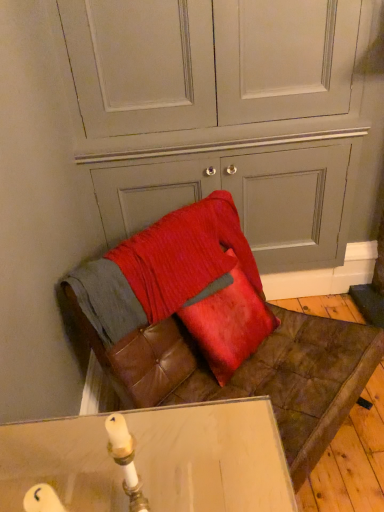
Where is `leather cushion at lower center`? This screenshot has height=512, width=384. leather cushion at lower center is located at coordinates (232, 116).

Is leather cushion at lower center facing towards satin red pillow at center?

Yes.

Considering the sizes of objects leather cushion at lower center and satin red pillow at center in the image provided, who is shorter, leather cushion at lower center or satin red pillow at center?

satin red pillow at center.

Considering the positions of objects leather cushion at lower center and satin red pillow at center in the image provided, who is more to the left, leather cushion at lower center or satin red pillow at center?

leather cushion at lower center is more to the left.

Is leather cushion at lower center positioned in front of satin red pillow at center?

No, the depth of leather cushion at lower center is greater than that of satin red pillow at center.

Which of these two, leather cushion at lower center or satin red pillow at center, stands shorter?

With less height is satin red pillow at center.

Who is smaller, leather cushion at lower center or satin red pillow at center?

Smaller between the two is satin red pillow at center.

Is leather cushion at lower center touching satin red pillow at center?

No, leather cushion at lower center is not in contact with satin red pillow at center.

From the image's perspective, which object appears higher, leather cushion at lower center or leather cushion at lower center?

From the image's view, leather cushion at lower center is above.

Locate an element on the screen. This screenshot has width=384, height=512. furniture below the leather cushion at lower center (from the image's perspective) is located at coordinates (249, 374).

Is leather cushion at lower center next to leather cushion at lower center and touching it?

No, leather cushion at lower center is not next to leather cushion at lower center.

Considering the sizes of objects leather cushion at lower center and leather cushion at lower center in the image provided, who is wider, leather cushion at lower center or leather cushion at lower center?

Wider between the two is leather cushion at lower center.

Is leather cushion at lower center inside satin red pillow at center?

No, leather cushion at lower center is located outside of satin red pillow at center.

Which of these two, satin red pillow at center or leather cushion at lower center, is bigger?

With larger size is leather cushion at lower center.

Looking at this image, is leather cushion at lower center smaller than leather cushion at lower center?

Yes.

Is leather cushion at lower center taller or shorter than leather cushion at lower center?

Clearly, leather cushion at lower center is shorter compared to leather cushion at lower center.

Is leather cushion at lower center surrounded by leather cushion at lower center?

No, leather cushion at lower center is not inside leather cushion at lower center.

What's the angular difference between leather cushion at lower center and leather cushion at lower center's facing directions?

They differ by 46 degrees in their facing directions.

Is satin red pillow at center aimed at leather cushion at lower center?

Yes, satin red pillow at center is turned towards leather cushion at lower center.

Is there a large distance between satin red pillow at center and leather cushion at lower center?

Actually, satin red pillow at center and leather cushion at lower center are a little close together.

Does satin red pillow at center contain leather cushion at lower center?

That's incorrect, leather cushion at lower center is not inside satin red pillow at center.

Visually, is satin red pillow at center positioned to the left or to the right of leather cushion at lower center?

From the image, it's evident that satin red pillow at center is to the left of leather cushion at lower center.

This screenshot has height=512, width=384. In order to click on throw pillow that is in front of the leather cushion at lower center in this screenshot , I will do `click(228, 321)`.

The width and height of the screenshot is (384, 512). I want to click on furniture below the satin red pillow at center (from a real-world perspective), so click(x=249, y=374).

Which object lies nearer to the anchor point leather cushion at lower center, satin red pillow at center or leather cushion at lower center?

Among the two, satin red pillow at center is located nearer to leather cushion at lower center.

Considering their positions, is leather cushion at lower center positioned closer to leather cushion at lower center than satin red pillow at center?

Among the two, satin red pillow at center is located nearer to leather cushion at lower center.

From the picture: Based on their spatial positions, is satin red pillow at center or leather cushion at lower center further from leather cushion at lower center?

Among the two, leather cushion at lower center is located further to leather cushion at lower center.

Based on their spatial positions, is leather cushion at lower center or satin red pillow at center further from leather cushion at lower center?

Based on the image, leather cushion at lower center appears to be further to leather cushion at lower center.

Considering their positions, is leather cushion at lower center positioned further to satin red pillow at center than leather cushion at lower center?

Based on the image, leather cushion at lower center appears to be further to satin red pillow at center.

When comparing their distances from satin red pillow at center, does leather cushion at lower center or leather cushion at lower center seem closer?

Based on the image, leather cushion at lower center appears to be nearer to satin red pillow at center.

Locate an element on the screen. throw pillow between leather cushion at lower center and leather cushion at lower center in the up-down direction is located at coordinates (228, 321).